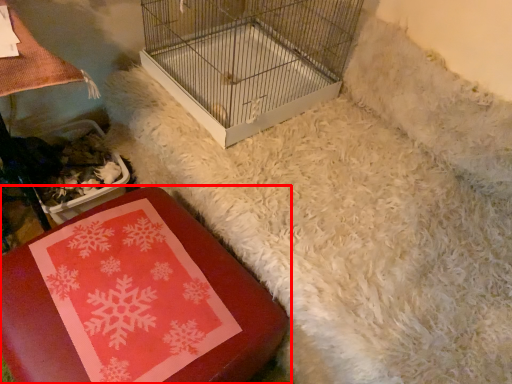
Question: Considering the relative positions of furniture (annotated by the red box) and bird cage in the image provided, where is furniture (annotated by the red box) located with respect to the staircase?

Choices:
 (A) right
 (B) left

Answer: (B)